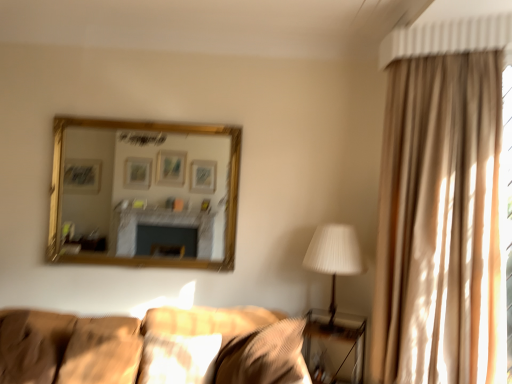
The image size is (512, 384). I want to click on empty space that is ontop of gold-framed mirror at upper center (from a real-world perspective), so click(153, 116).